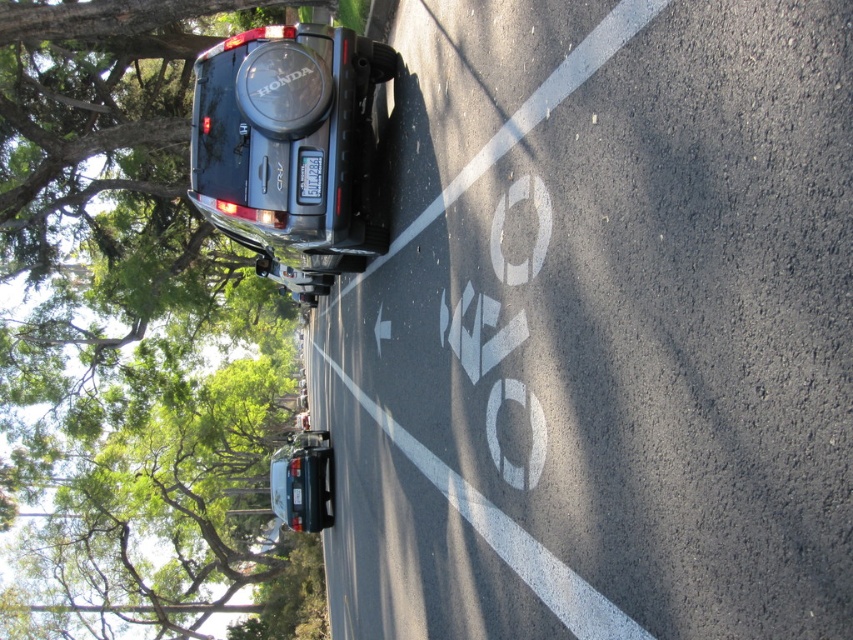
This screenshot has width=853, height=640. Describe the element at coordinates (289, 147) in the screenshot. I see `matte black suv at center` at that location.

Is matte black suv at center to the right of white plastic license plate at center from the viewer's perspective?

In fact, matte black suv at center is to the left of white plastic license plate at center.

Image resolution: width=853 pixels, height=640 pixels. I want to click on matte black suv at center, so click(289, 147).

Between white asphalt bike lane at upper center and shiny silver sedan at center, which one is positioned lower?

shiny silver sedan at center is lower down.

Is white asphalt bike lane at upper center further to the viewer compared to shiny silver sedan at center?

No, white asphalt bike lane at upper center is closer to the viewer.

The width and height of the screenshot is (853, 640). Describe the element at coordinates (601, 328) in the screenshot. I see `white asphalt bike lane at upper center` at that location.

This screenshot has height=640, width=853. In order to click on white asphalt bike lane at upper center in this screenshot , I will do `click(601, 328)`.

Is point (747, 545) farther from camera compared to point (312, 186)?

No.

Which is below, white asphalt bike lane at upper center or white plastic license plate at center?

Positioned lower is white asphalt bike lane at upper center.

Is point (405, 492) in front of point (299, 202)?

No, (405, 492) is further to viewer.

Identify the location of white asphalt bike lane at upper center. (601, 328).